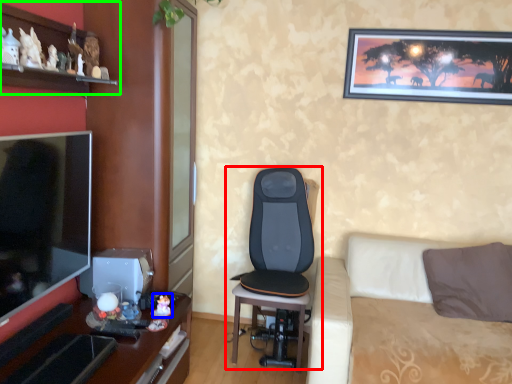
Question: Which object is the farthest from chair (highlighted by a red box)? Choose among these: toy (highlighted by a blue box) or shelf (highlighted by a green box).

Choices:
 (A) toy
 (B) shelf

Answer: (B)